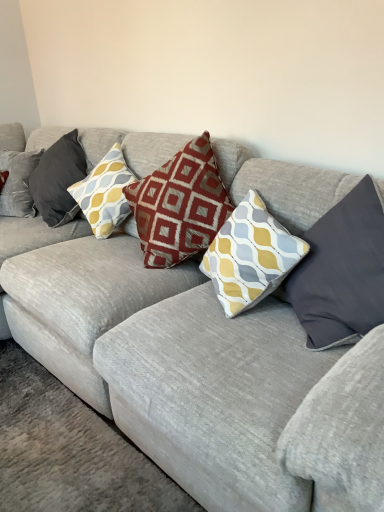
Question: From a real-world perspective, is red textured pillow at center, placed as the second pillow when sorted from left to right, physically above yellow and gray patterned pillow at center, positioned as the 2th pillow in right-to-left order?

Choices:
 (A) no
 (B) yes

Answer: (B)

Question: From a real-world perspective, is red textured pillow at center, placed as the second pillow when sorted from left to right, located beneath yellow and gray patterned pillow at center, positioned as the 2th pillow in right-to-left order?

Choices:
 (A) yes
 (B) no

Answer: (B)

Question: Does red textured pillow at center, the fourth pillow from the right, have a smaller size compared to yellow and gray patterned pillow at center, positioned as the 2th pillow in right-to-left order?

Choices:
 (A) no
 (B) yes

Answer: (A)

Question: Considering the relative positions of red textured pillow at center, placed as the second pillow when sorted from left to right, and yellow and gray patterned pillow at center, the fourth pillow viewed from the left, in the image provided, is red textured pillow at center, placed as the second pillow when sorted from left to right, to the left of yellow and gray patterned pillow at center, the fourth pillow viewed from the left, from the viewer's perspective?

Choices:
 (A) no
 (B) yes

Answer: (B)

Question: Would you say yellow and gray patterned pillow at center, the fourth pillow viewed from the left, is part of red textured pillow at center, the fourth pillow from the right,'s contents?

Choices:
 (A) yes
 (B) no

Answer: (B)

Question: From the image's perspective, would you say red textured pillow at center, the fourth pillow from the right, is positioned over yellow and gray patterned pillow at center, the fourth pillow viewed from the left?

Choices:
 (A) no
 (B) yes

Answer: (B)

Question: From a real-world perspective, does yellow and gray patterned pillow at center, positioned as the 2th pillow in right-to-left order, stand above velvet cushion at left, the 5th pillow from the right?

Choices:
 (A) yes
 (B) no

Answer: (B)

Question: Can you confirm if yellow and gray patterned pillow at center, the fourth pillow viewed from the left, is positioned to the left of velvet cushion at left, the 5th pillow from the right?

Choices:
 (A) no
 (B) yes

Answer: (A)

Question: Can you confirm if yellow and gray patterned pillow at center, positioned as the 2th pillow in right-to-left order, is smaller than velvet cushion at left, the first pillow from the left?

Choices:
 (A) yes
 (B) no

Answer: (A)

Question: Can you confirm if yellow and gray patterned pillow at center, the fourth pillow viewed from the left, is taller than velvet cushion at left, the first pillow from the left?

Choices:
 (A) yes
 (B) no

Answer: (B)

Question: Is yellow and gray patterned pillow at center, the fourth pillow viewed from the left, looking in the opposite direction of velvet cushion at left, the first pillow from the left?

Choices:
 (A) no
 (B) yes

Answer: (A)

Question: Does yellow and gray patterned pillow at center, the fourth pillow viewed from the left, have a larger size compared to velvet cushion at left, the first pillow from the left?

Choices:
 (A) no
 (B) yes

Answer: (A)

Question: From the image's perspective, is red textured pillow at center, placed as the second pillow when sorted from left to right, located beneath maroon fabric pillow at center, marked as the third pillow in a left-to-right arrangement?

Choices:
 (A) no
 (B) yes

Answer: (A)